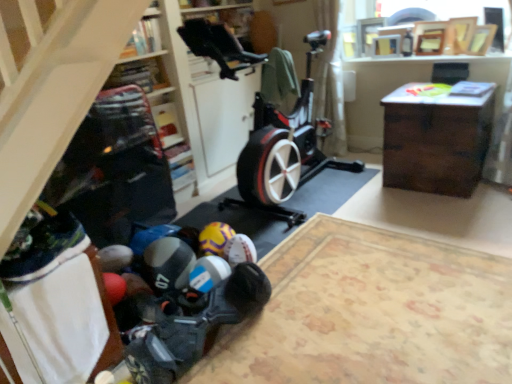
Locate an element on the screen. This screenshot has height=384, width=512. vacant space to the right of wooden cabinet at center is located at coordinates (357, 261).